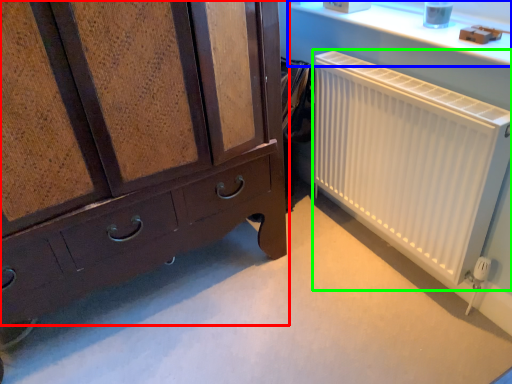
Question: Which is farther away from chest of drawers (highlighted by a red box)? window sill (highlighted by a blue box) or radiator (highlighted by a green box)?

Choices:
 (A) window sill
 (B) radiator

Answer: (A)